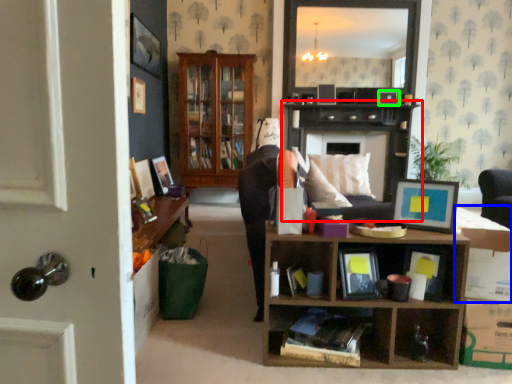
Question: Based on their relative distances, which object is nearer to cabinet (highlighted by a red box)? Choose from cardboard box (highlighted by a blue box) and picture frame (highlighted by a green box).

Choices:
 (A) cardboard box
 (B) picture frame

Answer: (B)